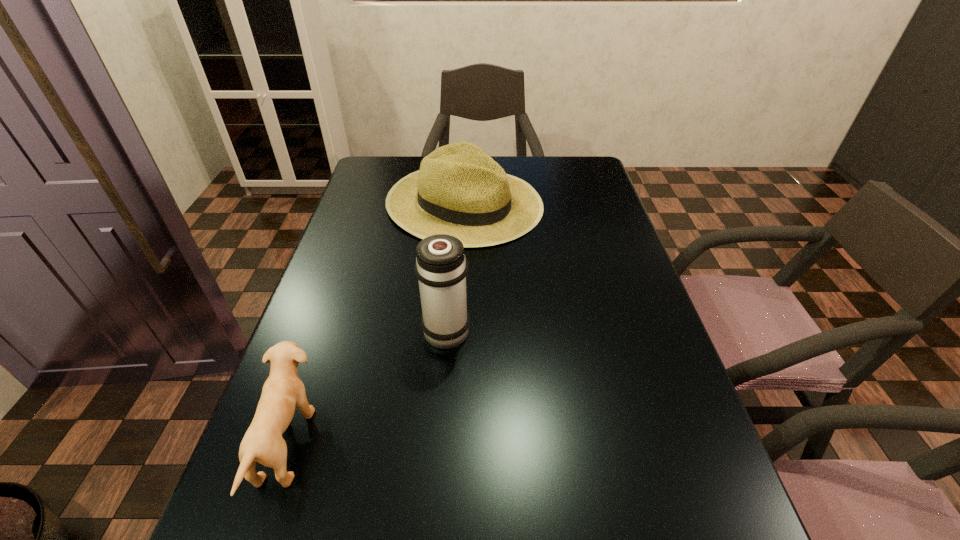
Identify the location of the second nearest object. Image resolution: width=960 pixels, height=540 pixels. (441, 267).

Where is `the tallest object`? The width and height of the screenshot is (960, 540). the tallest object is located at coordinates (441, 267).

Image resolution: width=960 pixels, height=540 pixels. I want to click on sunhat, so click(460, 190).

You are a GUI agent. You are given a task and a screenshot of the screen. Output one action in this format:
    pyautogui.click(x=<x>, y=<y>)
    Task: Click on the leftmost object
    
    Given the screenshot: What is the action you would take?
    pyautogui.click(x=283, y=390)

You are a GUI agent. You are given a task and a screenshot of the screen. Output one action in this format:
    pyautogui.click(x=<x>, y=<y>)
    Task: Click on the puppy
    The height and width of the screenshot is (540, 960).
    Given the screenshot: What is the action you would take?
    pyautogui.click(x=283, y=390)

Identify the location of vacant space located 0.110m on the side with the handle of the second farthest object. The image size is (960, 540). (450, 276).

Where is `vacant space located 0.200m on the side with the handle of the second farthest object`? The height and width of the screenshot is (540, 960). vacant space located 0.200m on the side with the handle of the second farthest object is located at coordinates (452, 254).

Find the location of a particular element. vacant space situated on the side with the handle of the second farthest object is located at coordinates (455, 218).

At what (x,y) coordinates should I click in order to perform the action: click on blank space located on the front of the sunhat. Please return your answer as a coordinate pair (x, y). The width and height of the screenshot is (960, 540). Looking at the image, I should click on (459, 308).

The image size is (960, 540). Find the location of `free space located on the left side of the nearest object`. free space located on the left side of the nearest object is located at coordinates click(343, 443).